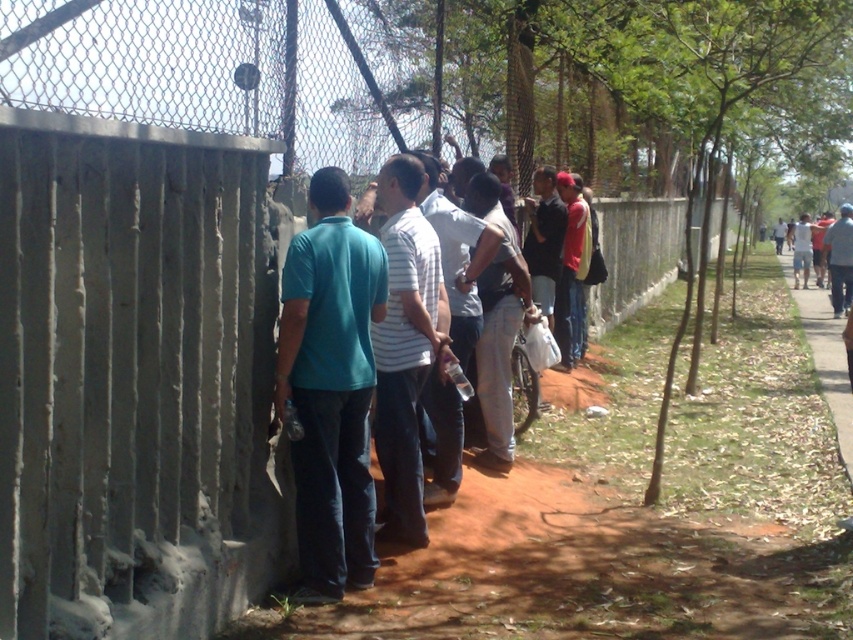
You are a photographer trying to capture a group photo of the people waiting in line. You notice the white striped shirt at center and the matte red shirt at center. Which shirt should you focus on to ensure it appears larger in your photo?

The matte red shirt at center is larger than the white striped shirt at center, so focusing on the matte red shirt at center will make it appear larger in the photo.

You are a photographer trying to capture a group photo of the people waiting in line. You notice two individuals wearing a teal matte shirt at center and a white striped shirt at center. Since you want to ensure both are visible in the frame, which person should you position closer to the camera to avoid being obscured by others?

The teal matte shirt at center should be positioned closer to the camera because it has a smaller size and might be harder to see from a distance compared to the larger white striped shirt at center.